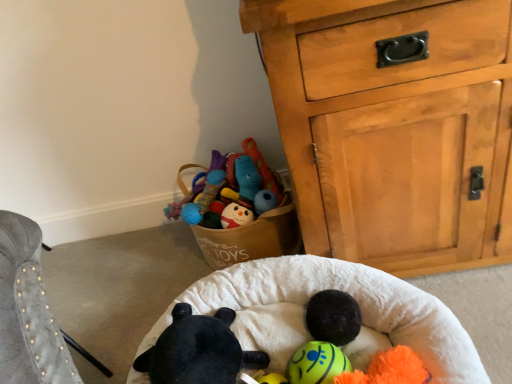
Question: Based on their sizes in the image, would you say neon yellow rubber ball at center, which is the 2th toy from left to right, is bigger or smaller than white soft infant bed at center?

Choices:
 (A) big
 (B) small

Answer: (B)

Question: From a real-world perspective, relative to white soft infant bed at center, is neon yellow rubber ball at center, which is the 2th toy from left to right, vertically above or below?

Choices:
 (A) above
 (B) below

Answer: (A)

Question: Which object is positioned closest to the white soft infant bed at center?

Choices:
 (A) black plush toy at center, which is the 2th toy in right-to-left order
 (B) neon yellow rubber ball at center, which is the 2th toy from left to right
 (C) light brown wooden chest of drawers at upper right

Answer: (A)

Question: Which is farther from the neon yellow rubber ball at center, acting as the first toy starting from the right?

Choices:
 (A) black plush toy at center, acting as the 1th toy starting from the left
 (B) light brown wooden chest of drawers at upper right
 (C) white soft infant bed at center

Answer: (B)